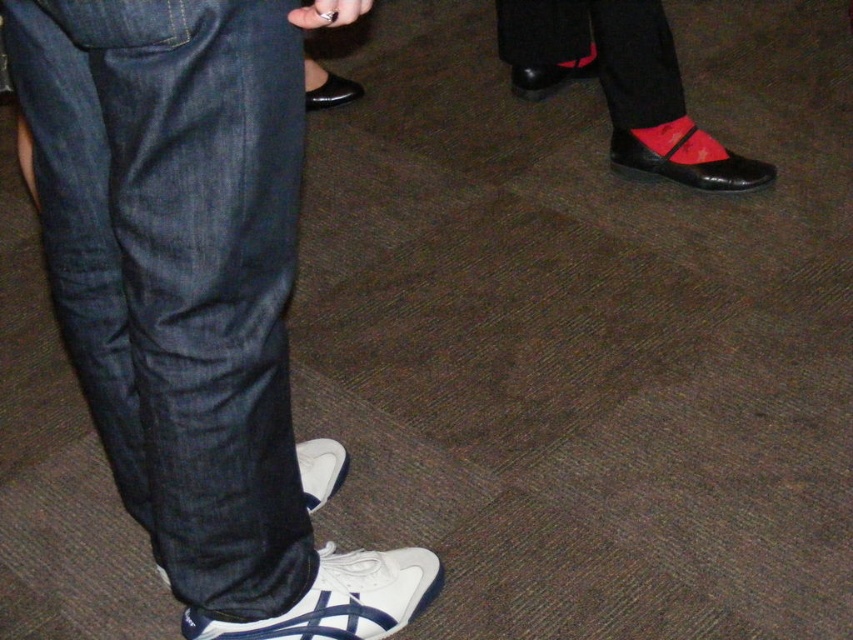
Who is lower down, shiny black shoe at upper right or shiny black shoe at center?

shiny black shoe at upper right is lower down.

How far apart are shiny black shoe at upper right and shiny black shoe at center?

shiny black shoe at upper right and shiny black shoe at center are 27.64 inches apart.

Does point (648, 172) come closer to viewer compared to point (354, 99)?

Yes, it is in front of point (354, 99).

You are a GUI agent. You are given a task and a screenshot of the screen. Output one action in this format:
    pyautogui.click(x=<x>, y=<y>)
    Task: Click on the shiny black shoe at upper right
    The height and width of the screenshot is (640, 853).
    Given the screenshot: What is the action you would take?
    pyautogui.click(x=622, y=83)

Which of these two, denim at left or shiny black shoe at upper right, stands taller?

denim at left is taller.

Does point (282, 144) lie behind point (612, 138)?

No, (282, 144) is in front of (612, 138).

Where is `denim at left`? The image size is (853, 640). denim at left is located at coordinates (178, 269).

Can you confirm if shiny black shoe at upper right is positioned to the right of white synthetic sneaker at lower center?

Correct, you'll find shiny black shoe at upper right to the right of white synthetic sneaker at lower center.

Who is shorter, shiny black shoe at upper right or white synthetic sneaker at lower center?

white synthetic sneaker at lower center is shorter.

Which is in front, point (660, 172) or point (331, 634)?

Positioned in front is point (331, 634).

Locate an element on the screen. This screenshot has height=640, width=853. shiny black shoe at upper right is located at coordinates (622, 83).